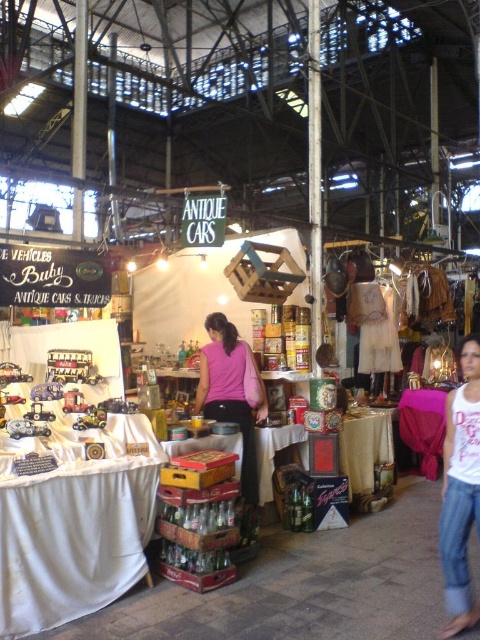
Question: Does pink cotton tank top at lower right come in front of pink matte shirt at center?

Choices:
 (A) no
 (B) yes

Answer: (B)

Question: Which of the following is the farthest from the observer?

Choices:
 (A) (446, 524)
 (B) (215, 380)

Answer: (B)

Question: Can you confirm if pink cotton tank top at lower right is positioned to the left of pink matte shirt at center?

Choices:
 (A) yes
 (B) no

Answer: (B)

Question: From the image, what is the correct spatial relationship of pink cotton tank top at lower right in relation to pink matte shirt at center?

Choices:
 (A) below
 (B) above

Answer: (A)

Question: Which point is closer to the camera?

Choices:
 (A) [x=211, y=417]
 (B) [x=477, y=465]

Answer: (B)

Question: Which object is farther from the camera taking this photo?

Choices:
 (A) pink cotton tank top at lower right
 (B) pink matte shirt at center

Answer: (B)